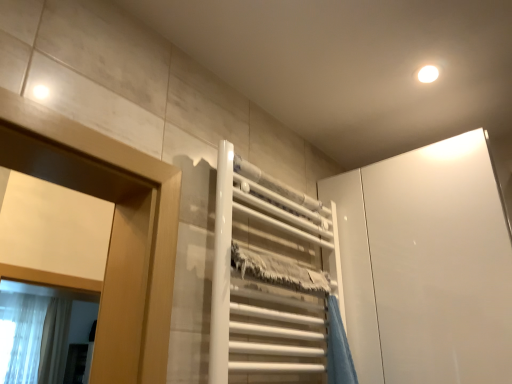
Question: Is white glossy cabinet at upper right oriented towards translucent fabric shower curtain at lower left?

Choices:
 (A) no
 (B) yes

Answer: (A)

Question: Is white glossy cabinet at upper right to the right of translucent fabric shower curtain at lower left from the viewer's perspective?

Choices:
 (A) no
 (B) yes

Answer: (B)

Question: Is white glossy cabinet at upper right bigger than translucent fabric shower curtain at lower left?

Choices:
 (A) no
 (B) yes

Answer: (B)

Question: From the image's perspective, does white glossy cabinet at upper right appear higher than translucent fabric shower curtain at lower left?

Choices:
 (A) no
 (B) yes

Answer: (B)

Question: From the image's perspective, would you say white glossy cabinet at upper right is shown under translucent fabric shower curtain at lower left?

Choices:
 (A) no
 (B) yes

Answer: (A)

Question: Can you confirm if white glossy cabinet at upper right is wider than translucent fabric shower curtain at lower left?

Choices:
 (A) no
 (B) yes

Answer: (B)

Question: Considering the relative positions of white glossy towel rack at center and white glossy cabinet at upper right in the image provided, is white glossy towel rack at center to the right of white glossy cabinet at upper right from the viewer's perspective?

Choices:
 (A) yes
 (B) no

Answer: (B)

Question: Is white glossy towel rack at center taller than white glossy cabinet at upper right?

Choices:
 (A) yes
 (B) no

Answer: (B)

Question: From the image's perspective, is white glossy towel rack at center located beneath white glossy cabinet at upper right?

Choices:
 (A) no
 (B) yes

Answer: (A)

Question: Can we say white glossy towel rack at center lies outside white glossy cabinet at upper right?

Choices:
 (A) no
 (B) yes

Answer: (B)

Question: Is white glossy towel rack at center in contact with white glossy cabinet at upper right?

Choices:
 (A) no
 (B) yes

Answer: (A)

Question: Is white glossy towel rack at center further to the viewer compared to white glossy cabinet at upper right?

Choices:
 (A) yes
 (B) no

Answer: (B)

Question: Does white glossy towel rack at center have a larger size compared to translucent fabric shower curtain at lower left?

Choices:
 (A) no
 (B) yes

Answer: (A)